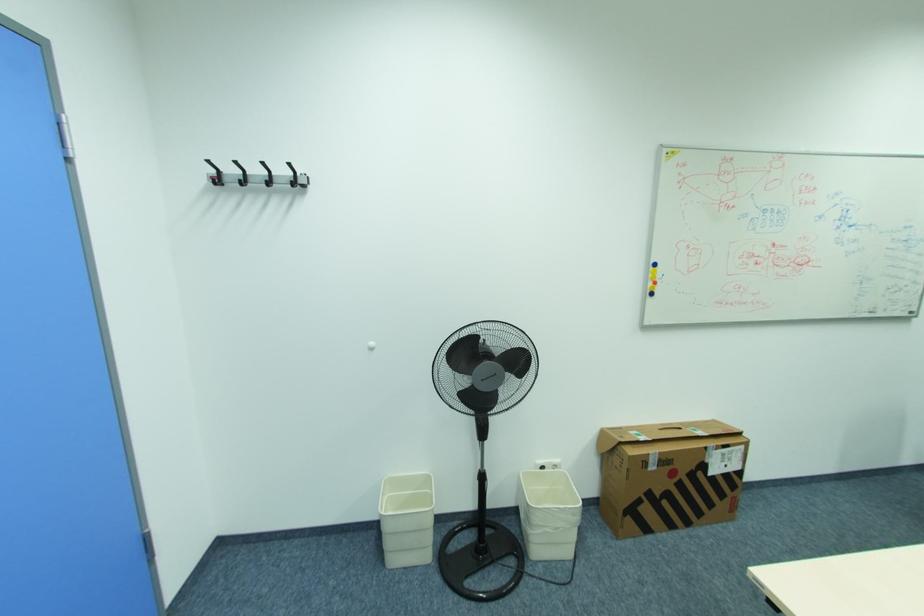
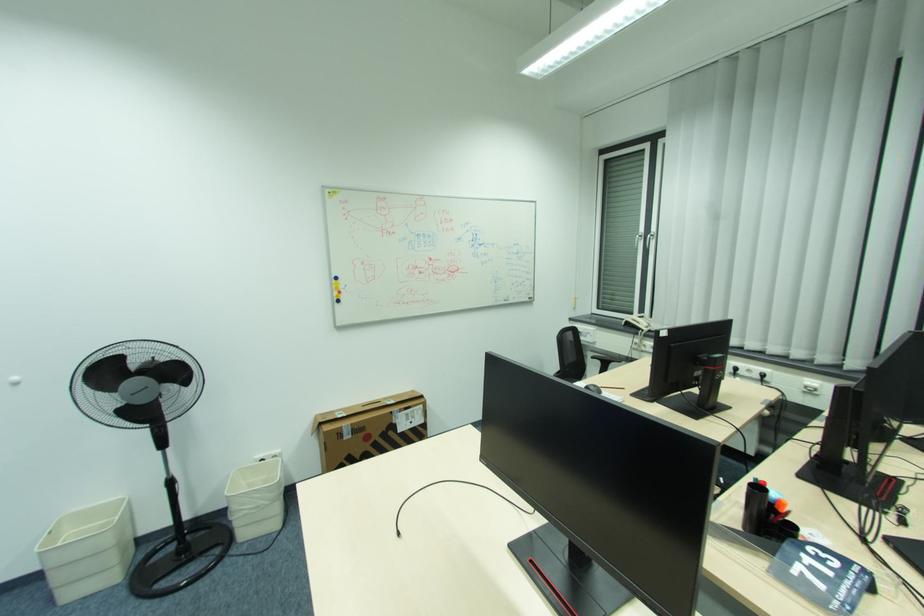
Locate, in the second image, the point that corresponds to the point at 564,528 in the first image.

(263, 507)